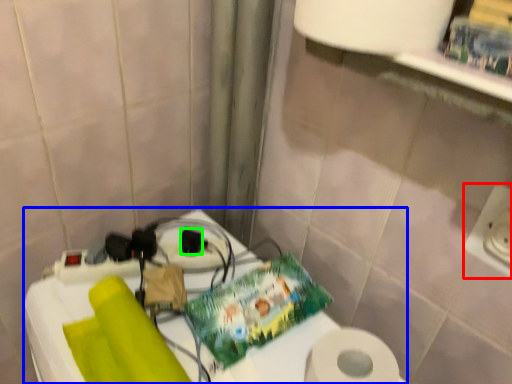
Question: Estimate the real-world distances between objects in this image. Which object is farther from electric outlet (highlighted by a red box), table (highlighted by a blue box) or socket (highlighted by a green box)?

Choices:
 (A) table
 (B) socket

Answer: (B)